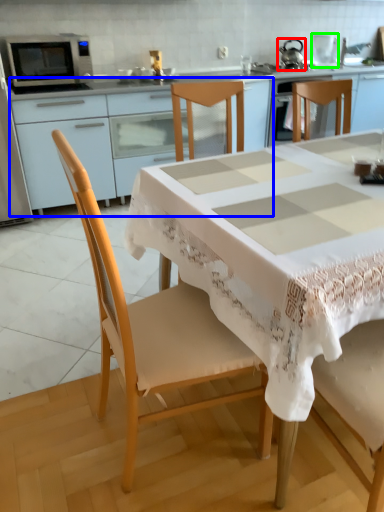
Question: Which object is positioned closest to tea pot (highlighted by a red box)? Select from cabinetry (highlighted by a blue box) and appliance (highlighted by a green box).

Choices:
 (A) cabinetry
 (B) appliance

Answer: (B)